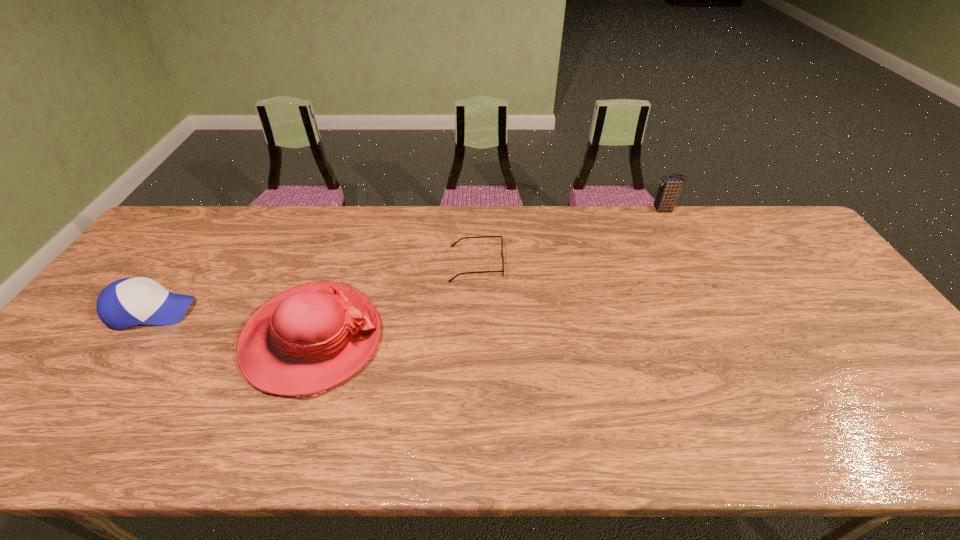
At what (x,y) coordinates should I click in order to perform the action: click on vacant space at the far right corner of the desktop. Please return your answer as a coordinate pair (x, y). Looking at the image, I should click on (762, 238).

Image resolution: width=960 pixels, height=540 pixels. Identify the location of free space at the near right corner of the desktop. (900, 427).

You are a GUI agent. You are given a task and a screenshot of the screen. Output one action in this format:
    pyautogui.click(x=<x>, y=<y>)
    Task: Click on the free spot between the leftmost object and the farthest object
    The height and width of the screenshot is (540, 960).
    Given the screenshot: What is the action you would take?
    pyautogui.click(x=408, y=260)

You are a GUI agent. You are given a task and a screenshot of the screen. Output one action in this format:
    pyautogui.click(x=<x>, y=<y>)
    Task: Click on the vacant area between the clutch bag and the third tallest object
    The width and height of the screenshot is (960, 540).
    Given the screenshot: What is the action you would take?
    click(408, 260)

Image resolution: width=960 pixels, height=540 pixels. What are the coordinates of `free space between the second shortest object and the rightmost object` in the screenshot? It's located at (408, 260).

This screenshot has width=960, height=540. Identify the location of empty location between the farthest object and the second object from right to left. (570, 237).

Locate an element on the screen. vacant region between the shortest object and the clutch bag is located at coordinates (570, 237).

Image resolution: width=960 pixels, height=540 pixels. Identify the location of vacant area that lies between the shortest object and the rightmost object. (570, 237).

The height and width of the screenshot is (540, 960). I want to click on vacant space in between the hat and the clutch bag, so click(x=489, y=275).

This screenshot has height=540, width=960. In order to click on free spot between the hat and the baseball cap in this screenshot , I will do `click(232, 325)`.